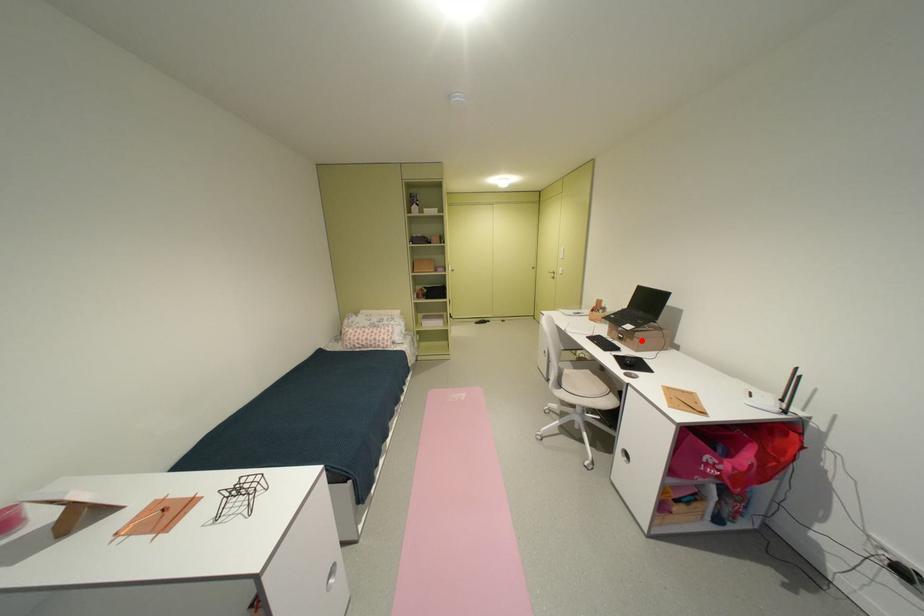
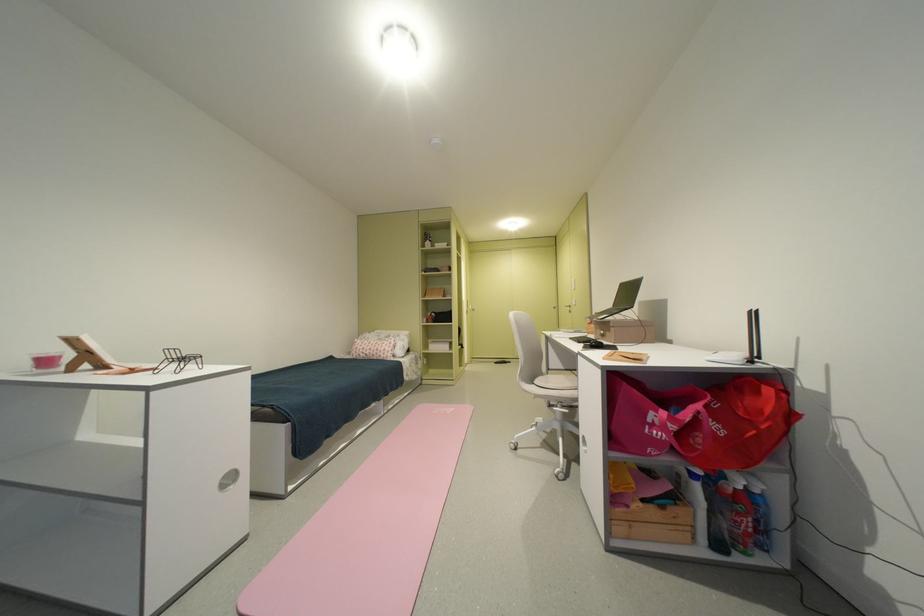
Where in the second image is the point corresponding to the highlighted location from the first image?

(618, 331)